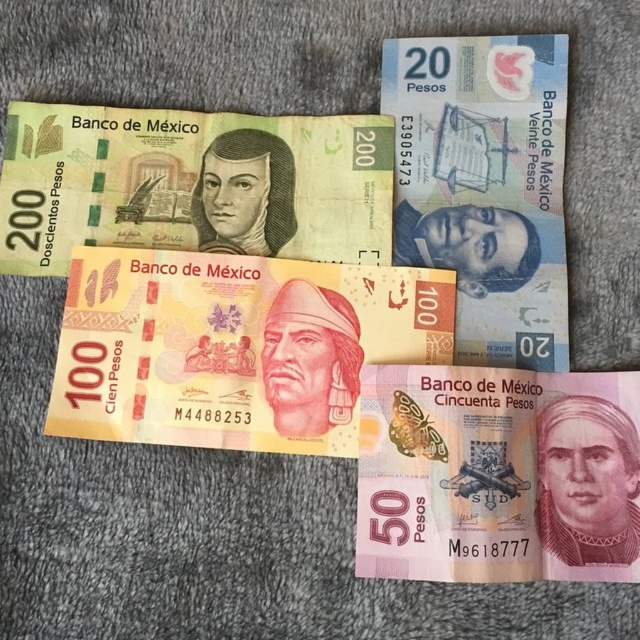
You are standing in front of the banknotes displayed on the gray surface. There are two points marked on the image, one at coordinate point [509,388] and the other at point [19,214]. Which point is closer to you?

Point [509,388] is closer to the viewer than point [19,214].

You are a currency collector examining two banknotes on a gray surface. You have the yellow paper currency at center and the pink paper money at center in front of you. Which one is taller?

The yellow paper currency at center is taller than the pink paper money at center.